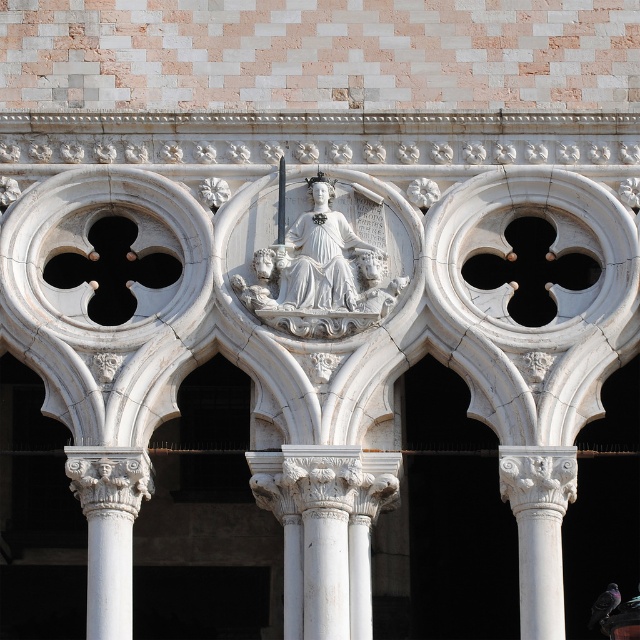
Can you confirm if white marble column at center is positioned above white marble column at lower left?

Yes, white marble column at center is above white marble column at lower left.

Identify the location of white marble column at center. The width and height of the screenshot is (640, 640). (324, 531).

This screenshot has height=640, width=640. In order to click on white marble column at center in this screenshot , I will do `click(324, 531)`.

Who is more distant from viewer, (x=356, y=550) or (x=332, y=232)?

The point (x=332, y=232) is behind.

Identify the location of white marble column at center. The image size is (640, 640). pyautogui.click(x=324, y=531).

Is white marble column at center closer to camera compared to white marble column at right?

That is False.

Who is more forward, (368, 532) or (540, 620)?

Point (540, 620) is more forward.

Find the location of a particular element. The width and height of the screenshot is (640, 640). white marble column at center is located at coordinates (324, 531).